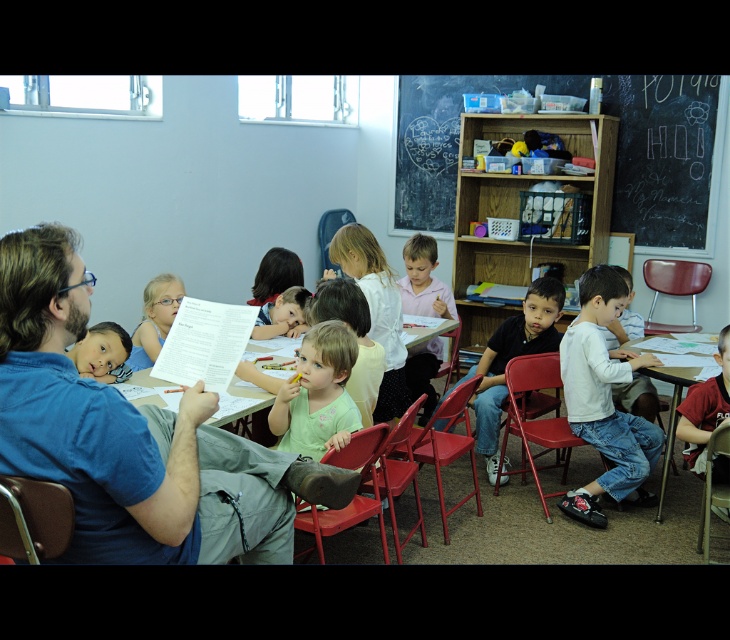
Between black matte shirt at center and smooth skin face at lower left, which one has less height?

smooth skin face at lower left

Is black matte shirt at center shorter than smooth skin face at lower left?

No, black matte shirt at center is not shorter than smooth skin face at lower left.

Is point (526, 337) farther from viewer compared to point (91, 356)?

Yes, point (526, 337) is behind point (91, 356).

Locate an element on the screen. The image size is (730, 640). black matte shirt at center is located at coordinates (511, 356).

Can you confirm if white matte shirt at center is taller than light green fabric shirt at center?

Correct, white matte shirt at center is much taller as light green fabric shirt at center.

Does point (584, 436) lie in front of point (299, 392)?

No.

This screenshot has height=640, width=730. Find the location of `white matte shirt at center`. white matte shirt at center is located at coordinates (603, 400).

Who is more distant from viewer, (x=301, y=378) or (x=434, y=282)?

The point (x=434, y=282) is behind.

Can you confirm if light green fabric shirt at center is bigger than pink matte shirt at center?

No.

Who is more distant from viewer, (322, 429) or (423, 241)?

The point (423, 241) is more distant.

At what (x,y) coordinates should I click in order to perform the action: click on light green fabric shirt at center. Please return your answer as a coordinate pair (x, y). The width and height of the screenshot is (730, 640). Looking at the image, I should click on (318, 394).